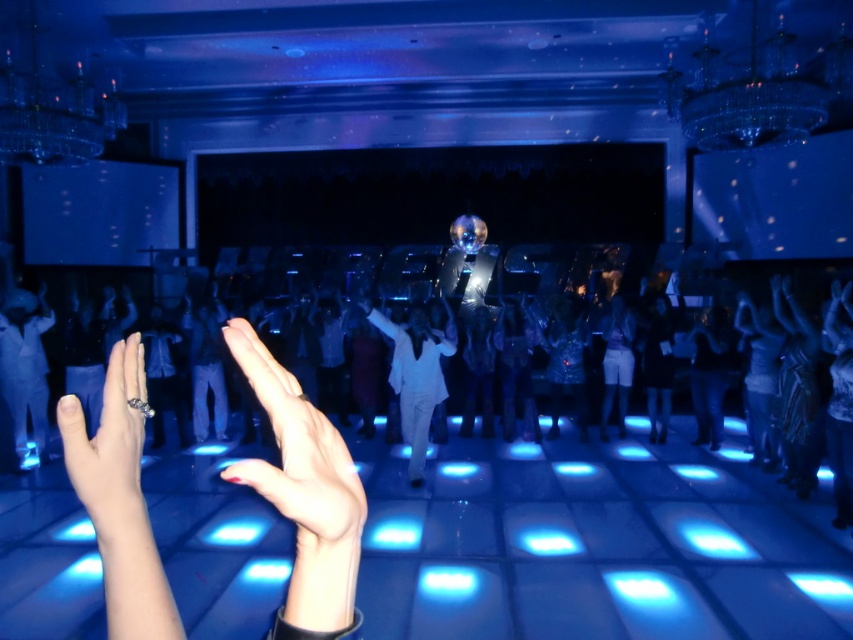
Question: Based on their relative distances, which object is farther from the matte white dress at lower left?

Choices:
 (A) silver metallic ring at lower left
 (B) white glossy suit at center
 (C) nail polish at center

Answer: (C)

Question: Which of the following is the farthest from the observer?

Choices:
 (A) (119, 349)
 (B) (21, 326)

Answer: (B)

Question: Does white glossy suit at center appear under matte white dress at lower left?

Choices:
 (A) no
 (B) yes

Answer: (B)

Question: Among these objects, which one is nearest to the camera?

Choices:
 (A) silver metallic ring at lower left
 (B) matte white dress at lower left
 (C) white glossy suit at center
 (D) nail polish at center

Answer: (D)

Question: Can you confirm if silver metallic ring at lower left is smaller than matte white dress at lower left?

Choices:
 (A) no
 (B) yes

Answer: (B)

Question: Does nail polish at center appear on the right side of white glossy suit at center?

Choices:
 (A) no
 (B) yes

Answer: (B)